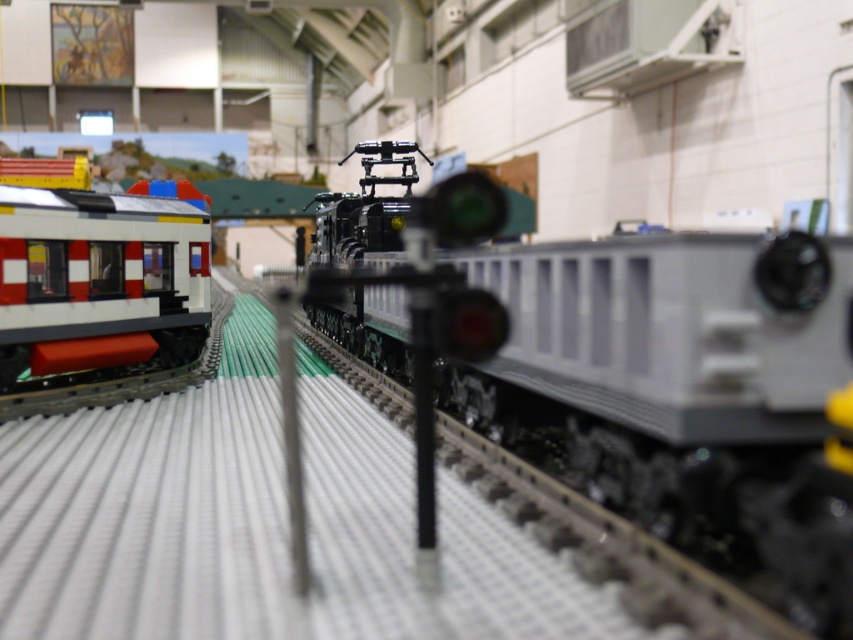
Question: Which point is farther to the camera?

Choices:
 (A) matte black train car at left
 (B) matte black train at center

Answer: (A)

Question: Is matte black train at center above matte black train car at left?

Choices:
 (A) no
 (B) yes

Answer: (A)

Question: Is matte black train at center wider than matte black train car at left?

Choices:
 (A) no
 (B) yes

Answer: (B)

Question: Where is matte black train at center located in relation to matte black train car at left in the image?

Choices:
 (A) right
 (B) left

Answer: (A)

Question: Which point appears farthest from the camera in this image?

Choices:
 (A) (175, 257)
 (B) (828, 241)

Answer: (A)